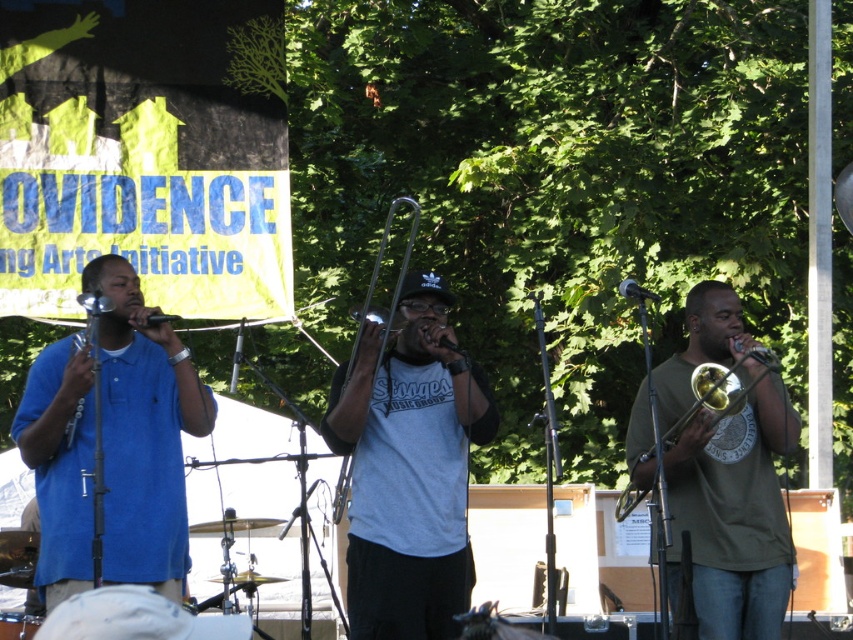
Question: Among these points, which one is farthest from the camera?

Choices:
 (A) (334, 509)
 (B) (650, 451)
 (C) (376, 456)

Answer: (A)

Question: Which object is positioned farthest from the gray cotton t-shirt at center?

Choices:
 (A) silver metallic trombone at center
 (B) gold brass trumpet at center
 (C) green matte shirt at center
 (D) matte blue shirt at left

Answer: (C)

Question: Does gray cotton t-shirt at center have a greater width compared to green matte shirt at center?

Choices:
 (A) yes
 (B) no

Answer: (A)

Question: Is gray cotton t-shirt at center below silver metallic trombone at center?

Choices:
 (A) no
 (B) yes

Answer: (B)

Question: Which point is farther to the camera?

Choices:
 (A) gold brass trumpet at center
 (B) matte blue shirt at left

Answer: (A)

Question: Can you confirm if gray cotton t-shirt at center is wider than gold brass trumpet at center?

Choices:
 (A) yes
 (B) no

Answer: (A)